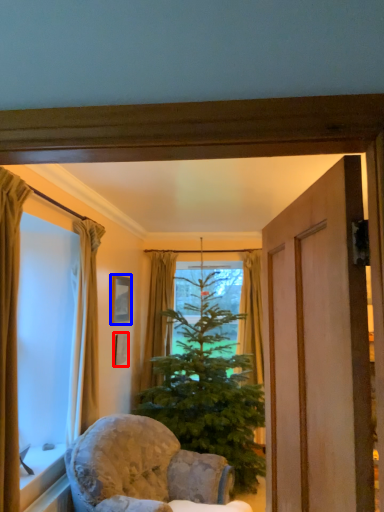
Question: Which object appears farthest to the camera in this image, picture frame (highlighted by a red box) or picture frame (highlighted by a blue box)?

Choices:
 (A) picture frame
 (B) picture frame

Answer: (A)